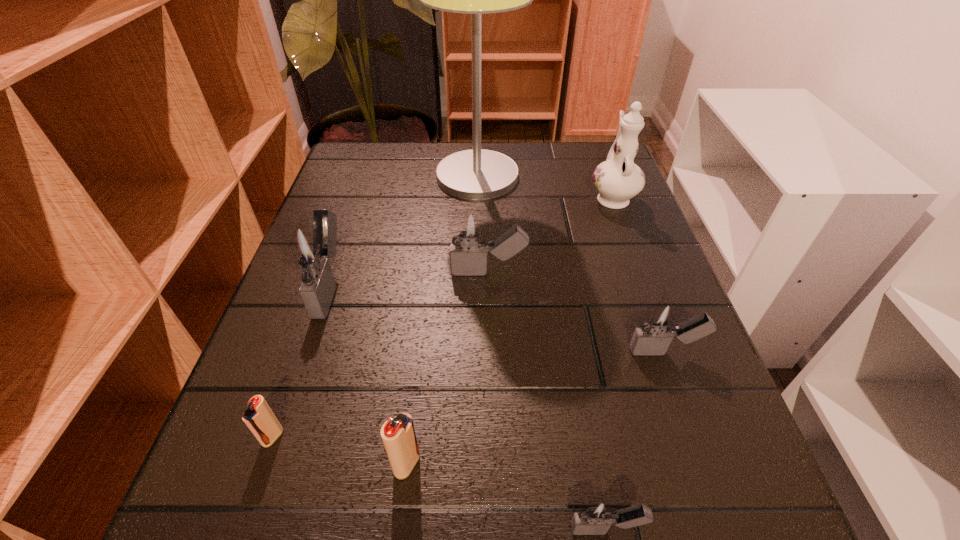
What are the coordinates of `the tallest object` in the screenshot? It's located at (476, 174).

Identify the location of the second tallest object. (618, 179).

Where is `the biggest gray igniter`? This screenshot has height=540, width=960. the biggest gray igniter is located at coordinates (311, 249).

Identify the location of the leftmost gray igniter. (311, 249).

The height and width of the screenshot is (540, 960). What are the coordinates of `the fourth tallest object` in the screenshot? It's located at (469, 230).

Image resolution: width=960 pixels, height=540 pixels. What are the coordinates of `the third gray igniter from right to left` in the screenshot? It's located at (469, 230).

Find the location of a particular element. This screenshot has height=540, width=960. the rightmost igniter is located at coordinates (659, 324).

Locate an element on the screen. the fourth nearest object is located at coordinates (659, 324).

The width and height of the screenshot is (960, 540). In order to click on the fifth farthest igniter in this screenshot , I will do [x=398, y=434].

This screenshot has width=960, height=540. I want to click on the bigger red igniter, so click(x=398, y=434).